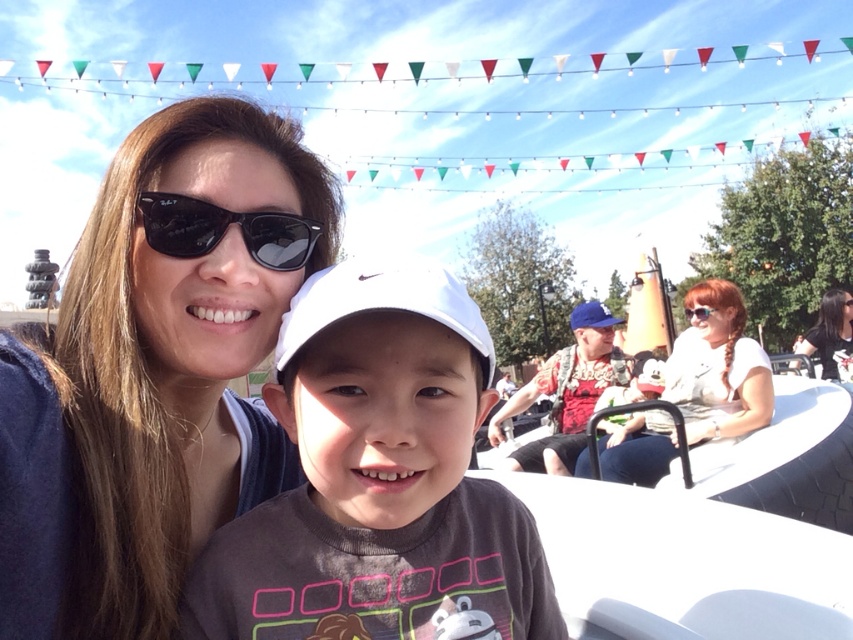
You are a photographer taking a picture of the gray matte shirt at center and the blue fabric baseball cap at center. Which object should you focus on first if you want to capture both clearly in the same frame?

The gray matte shirt at center is below the blue fabric baseball cap at center, so you should focus on the blue fabric baseball cap at center first to ensure both are in focus.

You are standing at the base of the carousel and want to place a gift box between the black matte sunglasses at upper left and the blue fabric baseball cap at center. The gift box requires 3 meters of space. Is there enough space between them?

The black matte sunglasses at upper left and blue fabric baseball cap at center are 4.25 meters apart, so yes, there is enough space between them to place the gift box requiring 3 meters of space.